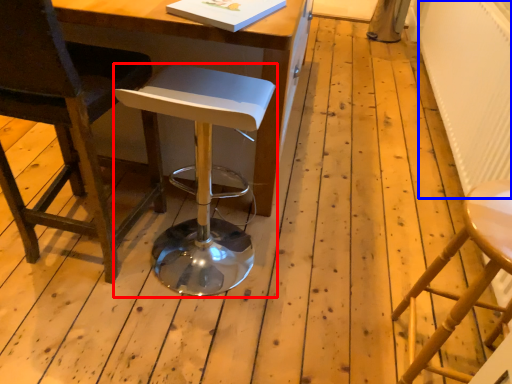
Question: Which object is further to the camera taking this photo, stool (highlighted by a red box) or radiator (highlighted by a blue box)?

Choices:
 (A) stool
 (B) radiator

Answer: (B)